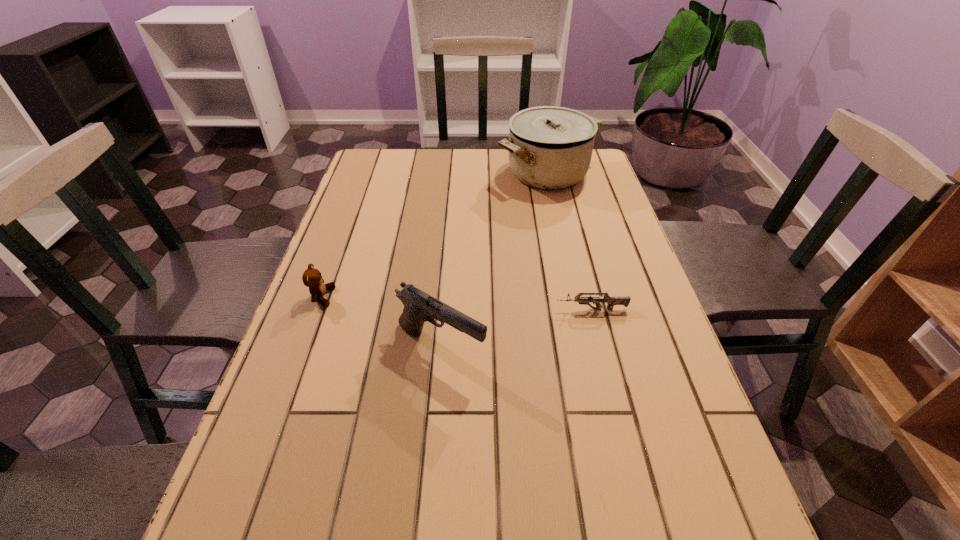
At what (x,y) coordinates should I click in order to perform the action: click on free spot at the left edge of the desktop. Please return your answer as a coordinate pair (x, y). The width and height of the screenshot is (960, 540). Looking at the image, I should click on (364, 207).

Locate an element on the screen. This screenshot has height=540, width=960. vacant space at the right edge of the desktop is located at coordinates (614, 251).

Locate an element on the screen. free space at the far left corner of the desktop is located at coordinates (388, 156).

Where is `empty space that is in between the third object from right to left and the leftmost object`? The height and width of the screenshot is (540, 960). empty space that is in between the third object from right to left and the leftmost object is located at coordinates (381, 322).

Locate an element on the screen. The height and width of the screenshot is (540, 960). empty space that is in between the nearest object and the teddy bear is located at coordinates (381, 322).

Identify the location of blank region between the teddy bear and the second object from left to right. (381, 322).

The width and height of the screenshot is (960, 540). I want to click on free space between the saucepan and the shortest object, so click(x=569, y=241).

At what (x,y) coordinates should I click in order to perform the action: click on free space between the tallest object and the second shortest object. Please return your answer as a coordinate pair (x, y). The height and width of the screenshot is (540, 960). Looking at the image, I should click on (435, 235).

I want to click on vacant region between the third tallest object and the tallest object, so click(435, 235).

Find the location of a particular element. The width and height of the screenshot is (960, 540). free spot between the leftmost object and the tallest object is located at coordinates (435, 235).